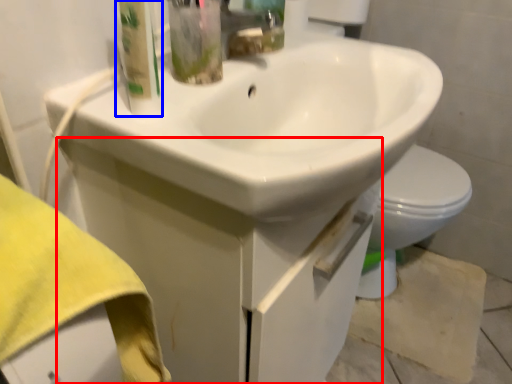
Question: Among these objects, which one is farthest to the camera, drawer (highlighted by a red box) or cleaning product (highlighted by a blue box)?

Choices:
 (A) drawer
 (B) cleaning product

Answer: (A)